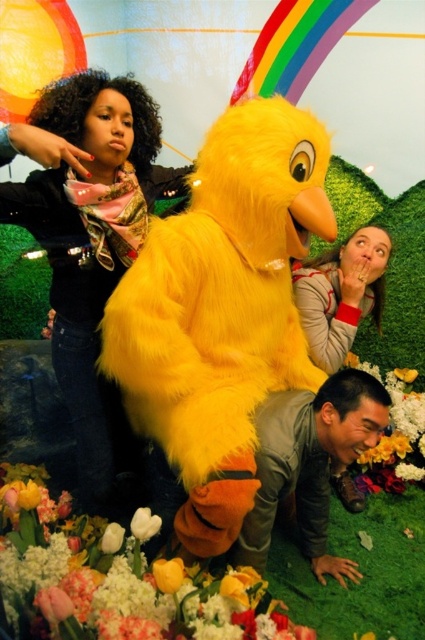
Does gray leather jacket at lower center have a lesser width compared to matte gray sweater at center?

No, gray leather jacket at lower center is not thinner than matte gray sweater at center.

Does gray leather jacket at lower center appear under matte gray sweater at center?

Indeed, gray leather jacket at lower center is positioned under matte gray sweater at center.

This screenshot has width=425, height=640. What do you see at coordinates (309, 464) in the screenshot?
I see `gray leather jacket at lower center` at bounding box center [309, 464].

Find the location of a particular element. The height and width of the screenshot is (640, 425). gray leather jacket at lower center is located at coordinates (309, 464).

Does fluffy yellow bird at center lie in front of soft yellow petals at lower center?

No, it is not.

Does fluffy yellow bird at center have a larger size compared to soft yellow petals at lower center?

Correct, fluffy yellow bird at center is larger in size than soft yellow petals at lower center.

Describe the element at coordinates (221, 308) in the screenshot. I see `fluffy yellow bird at center` at that location.

Where is `fluffy yellow bird at center`? The width and height of the screenshot is (425, 640). fluffy yellow bird at center is located at coordinates (221, 308).

Does gray leather jacket at lower center appear under white matte tulip at center?

No.

Is gray leather jacket at lower center further to camera compared to white matte tulip at center?

Yes.

Is point (252, 509) positioned behind point (147, 538)?

Yes, it is.

The width and height of the screenshot is (425, 640). I want to click on gray leather jacket at lower center, so click(x=309, y=464).